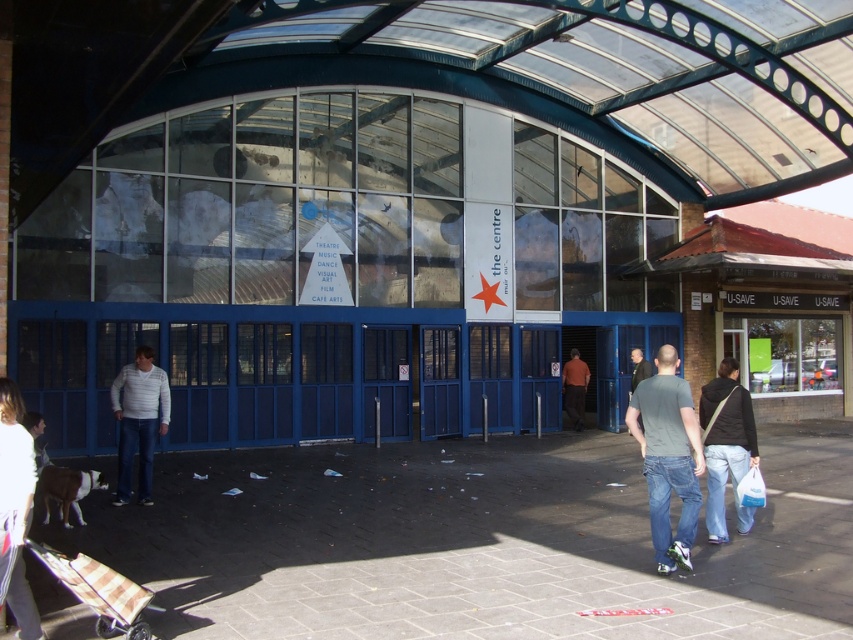
Consider the image. Does white cotton sweater at lower left have a lesser width compared to white sweater at center?

Correct, white cotton sweater at lower left's width is less than white sweater at center's.

Locate an element on the screen. The image size is (853, 640). white cotton sweater at lower left is located at coordinates (15, 509).

Is point (9, 512) behind point (120, 492)?

No, (9, 512) is closer to viewer.

Image resolution: width=853 pixels, height=640 pixels. What are the coordinates of `white cotton sweater at lower left` in the screenshot? It's located at (15, 509).

Find the location of `white sweater at center`. white sweater at center is located at coordinates (138, 420).

Who is positioned more to the right, white sweater at center or orange t-shirt at center?

From the viewer's perspective, orange t-shirt at center appears more on the right side.

Describe the element at coordinates (138, 420) in the screenshot. The width and height of the screenshot is (853, 640). I see `white sweater at center` at that location.

This screenshot has width=853, height=640. What are the coordinates of `white sweater at center` in the screenshot? It's located at (138, 420).

Is matte gray t-shirt at center below orange t-shirt at center?

Incorrect, matte gray t-shirt at center is not positioned below orange t-shirt at center.

Is point (647, 378) closer to viewer compared to point (579, 410)?

Yes, it is.

Find the location of `matte gray t-shirt at center`. matte gray t-shirt at center is located at coordinates (668, 458).